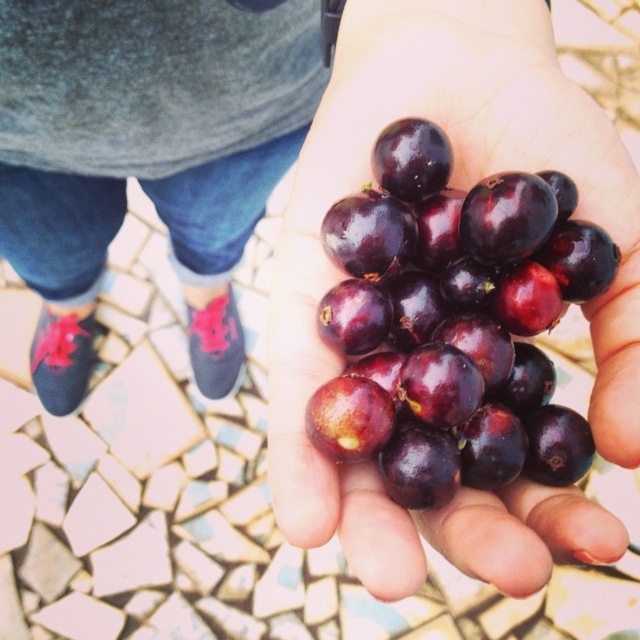
Question: Which point is closer to the camera?

Choices:
 (A) matte black shoes at lower left
 (B) shiny dark purple grapes at center

Answer: (B)

Question: Observing the image, what is the correct spatial positioning of shiny dark purple grapes at center in reference to matte black shoes at lower left?

Choices:
 (A) right
 (B) left

Answer: (A)

Question: Is shiny dark purple grapes at center positioned at the back of matte black shoes at lower left?

Choices:
 (A) yes
 (B) no

Answer: (B)

Question: Which point is farther to the camera?

Choices:
 (A) shiny dark purple grapes at center
 (B) matte black shoes at lower left

Answer: (B)

Question: Can you confirm if shiny dark purple grapes at center is positioned above matte black shoes at lower left?

Choices:
 (A) yes
 (B) no

Answer: (B)

Question: Which point is closer to the camera?

Choices:
 (A) (312, 275)
 (B) (289, 92)

Answer: (A)